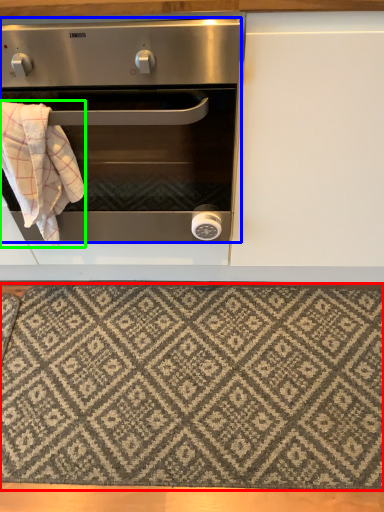
Question: Which object is the farthest from mat (highlighted by a red box)? Choose among these: oven (highlighted by a blue box) or blanket (highlighted by a green box).

Choices:
 (A) oven
 (B) blanket

Answer: (B)